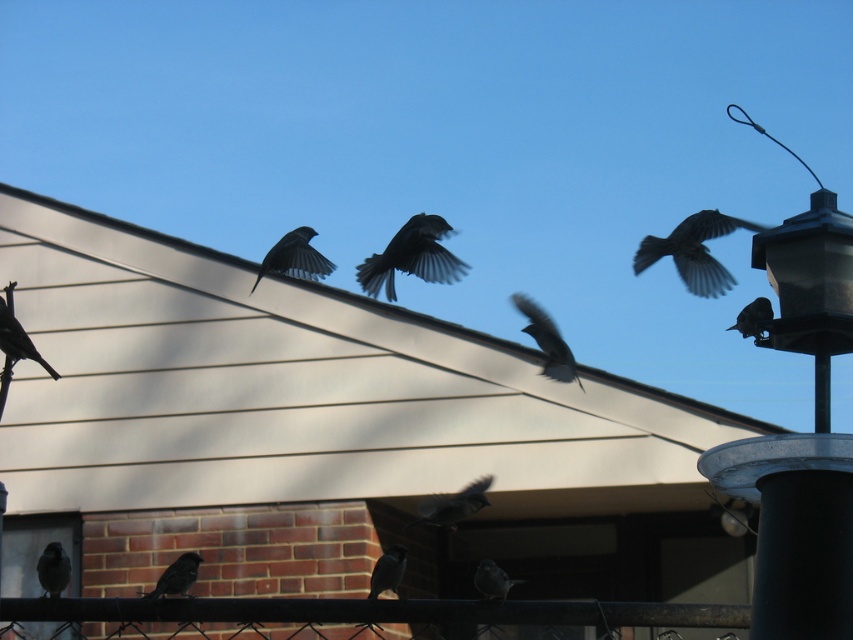
Does black glossy bird at center have a larger size compared to dark gray feathers at center?

Yes, black glossy bird at center is bigger than dark gray feathers at center.

Consider the image. Does black glossy bird at center appear under dark gray feathers at center?

No, black glossy bird at center is not below dark gray feathers at center.

Image resolution: width=853 pixels, height=640 pixels. I want to click on black glossy bird at center, so click(412, 257).

Between dark gray feathers at upper right and brown matte bird at lower left, which one is positioned lower?

brown matte bird at lower left

From the picture: Is dark gray feathers at upper right thinner than brown matte bird at lower left?

No.

Which is in front, point (740, 225) or point (196, 561)?

Point (196, 561) is in front.

You are a GUI agent. You are given a task and a screenshot of the screen. Output one action in this format:
    pyautogui.click(x=<x>, y=<y>)
    Task: Click on the dark gray feathers at upper right
    
    Given the screenshot: What is the action you would take?
    pyautogui.click(x=694, y=252)

Who is positioned more to the left, dark gray feathers at upper center or brown speckled feather at lower center?

Positioned to the left is dark gray feathers at upper center.

Which is behind, point (317, 276) or point (483, 579)?

Positioned behind is point (317, 276).

Find the location of a particular element. dark gray feathers at upper center is located at coordinates (294, 257).